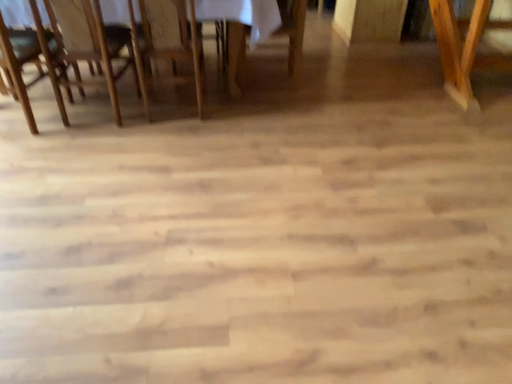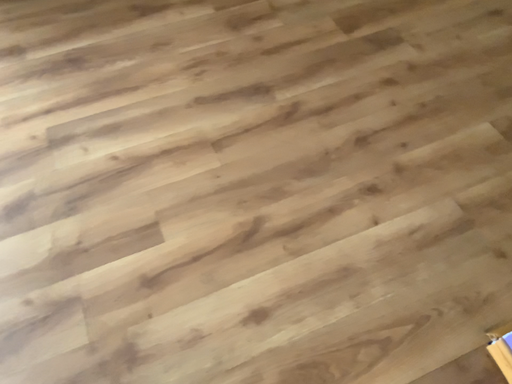
Question: How did the camera likely rotate when shooting the video?

Choices:
 (A) rotated right
 (B) rotated left

Answer: (A)